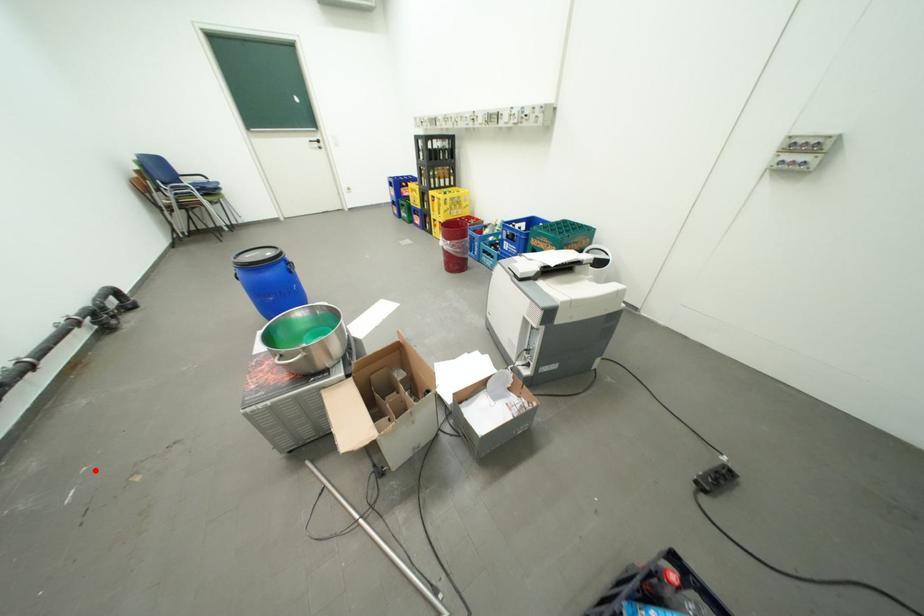
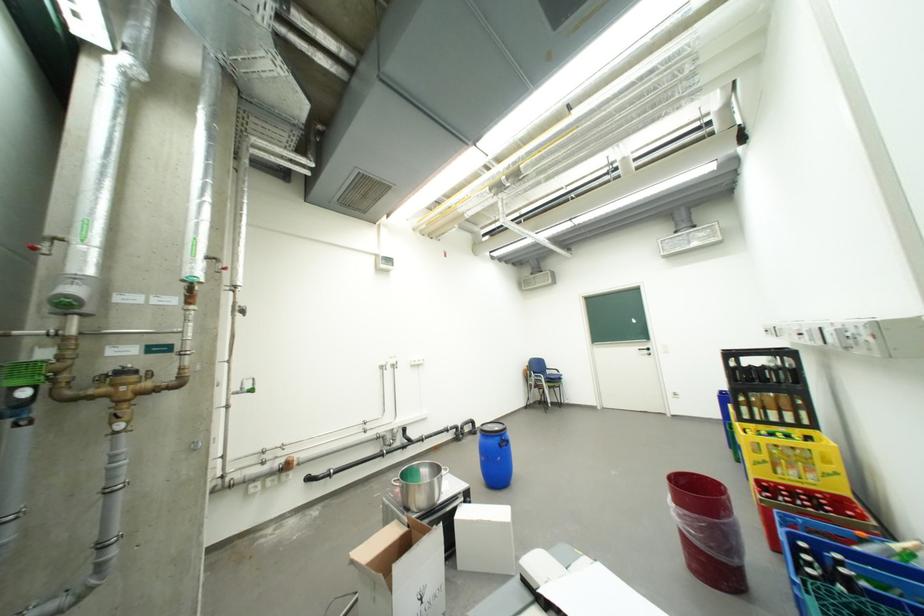
In the second image, find the point that corresponds to the highlighted location in the first image.

(398, 490)